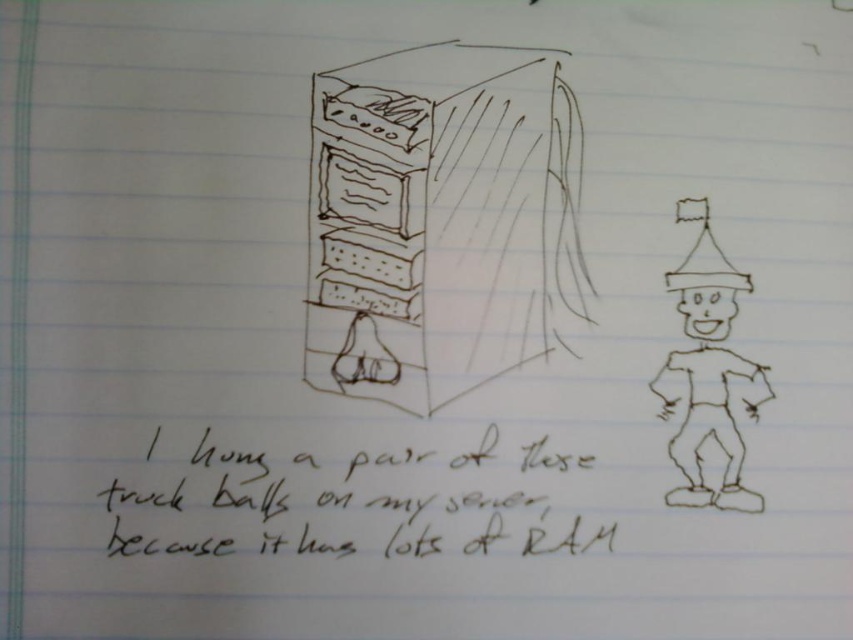
You are standing in front of the server and want to place a small sticker exactly at the point marked as point (274, 531). If your hand can reach up to 34 inches, can you comfortably place the sticker without moving your position?

The point (274, 531) is 33.93 inches away from the viewer, which is within your reach since your hand can extend up to 34 inches. Therefore, you can comfortably place the sticker without moving.

You are looking at the drawing and want to determine the spatial relationship between the matte black server at center and the black ink handwriting at center. Which object is closer to the viewer?

The matte black server at center is closer to the viewer than the black ink handwriting at center.

You are looking at the hand drawn illustration of a server and a cartoonish figure. There are two points marked in the image. The first point is at coordinate point (x=515, y=112) and the second point is at coordinate point (x=683, y=314). Which of these two points is closer to you?

Point (x=515, y=112) is closer to the viewer than point (x=683, y=314).